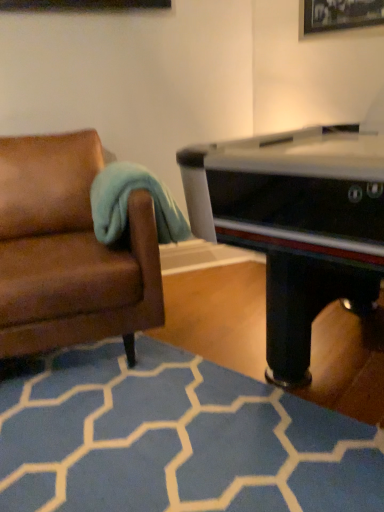
Question: Considering the positions of teal soft fabric at left and blue carpet at lower center in the image, is teal soft fabric at left bigger or smaller than blue carpet at lower center?

Choices:
 (A) small
 (B) big

Answer: (B)

Question: From their relative heights in the image, would you say teal soft fabric at left is taller or shorter than blue carpet at lower center?

Choices:
 (A) tall
 (B) short

Answer: (A)

Question: Which object is positioned farthest from the blue carpet at lower center?

Choices:
 (A) brown leather couch at left
 (B) teal soft fabric at left

Answer: (B)

Question: Which object is the closest to the blue carpet at lower center?

Choices:
 (A) teal soft fabric at left
 (B) brown leather couch at left

Answer: (B)